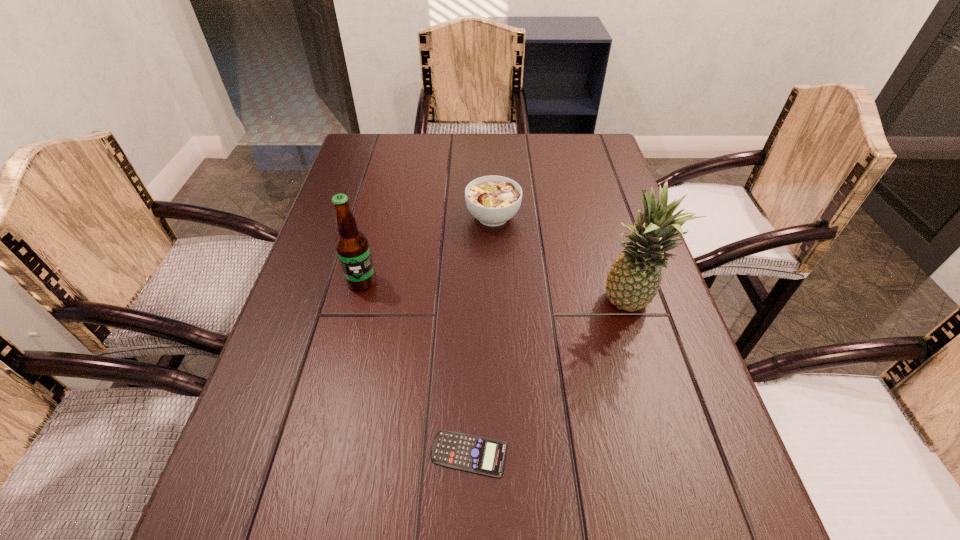
Find the location of a particular element. The image size is (960, 540). free space between the beer bottle and the farthest object is located at coordinates coord(427,249).

Identify the location of blank region between the farthest object and the tallest object. pos(561,261).

The width and height of the screenshot is (960, 540). Identify the location of free space that is in between the third tallest object and the calculator. (481, 335).

I want to click on free point between the second tallest object and the calculator, so click(x=416, y=368).

Find the location of a particular element. unoccupied area between the beer bottle and the shortest object is located at coordinates (416, 368).

Where is `vacant area that lies between the farthest object and the beer bottle`? vacant area that lies between the farthest object and the beer bottle is located at coordinates (427, 249).

In order to click on vacant point located between the tallest object and the leftmost object in this screenshot , I will do `click(495, 293)`.

Find the location of a particular element. The image size is (960, 540). object that can be found as the second closest to the pineapple is located at coordinates (481, 455).

Find the location of a particular element. The height and width of the screenshot is (540, 960). object that can be found as the third closest to the leftmost object is located at coordinates (634, 279).

Where is `free spot that satisfies the following two spatial constraints: 1. on the label of the leftmost object; 2. on the right side of the nearest object`? The width and height of the screenshot is (960, 540). free spot that satisfies the following two spatial constraints: 1. on the label of the leftmost object; 2. on the right side of the nearest object is located at coordinates (318, 454).